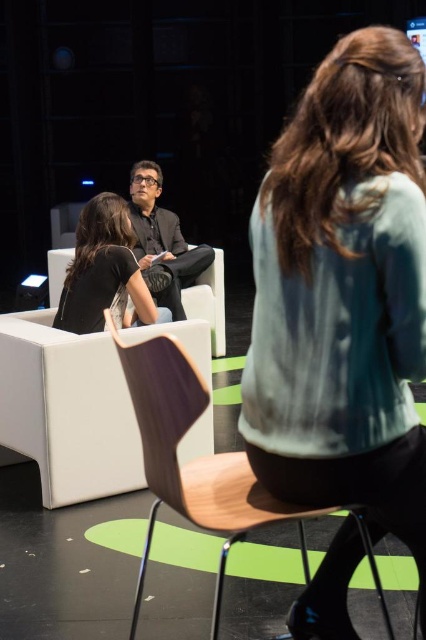
Question: Based on their relative distances, which object is farther from the matte black shirt at center?

Choices:
 (A) black fabric shirt at center
 (B) light blue sweater at center
 (C) wooden chair at center
 (D) white leather armchair at left

Answer: (B)

Question: Estimate the real-world distances between objects in this image. Which object is closer to the white leather armchair at left?

Choices:
 (A) black fabric shirt at center
 (B) matte black shirt at center
 (C) wooden chair at center

Answer: (A)

Question: Which point appears farthest from the camera in this image?

Choices:
 (A) (149, 163)
 (B) (66, 380)
 (C) (109, 301)

Answer: (A)

Question: Is white leather armchair at left thinner than matte black shirt at center?

Choices:
 (A) yes
 (B) no

Answer: (B)

Question: Does light blue sweater at center lie behind wooden chair at center?

Choices:
 (A) yes
 (B) no

Answer: (B)

Question: Is white leather armchair at left positioned behind black fabric shirt at center?

Choices:
 (A) yes
 (B) no

Answer: (B)